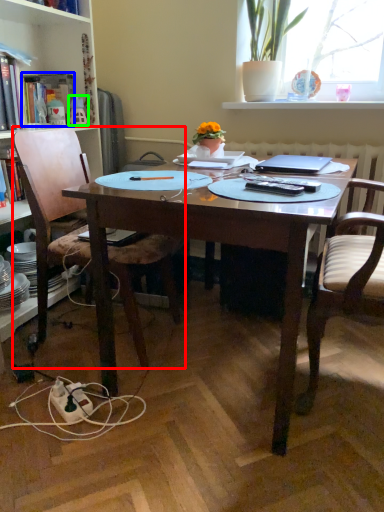
Question: Which object is the closest to the chair (highlighted by a red box)? Choose among these: book (highlighted by a blue box) or toy (highlighted by a green box).

Choices:
 (A) book
 (B) toy

Answer: (A)